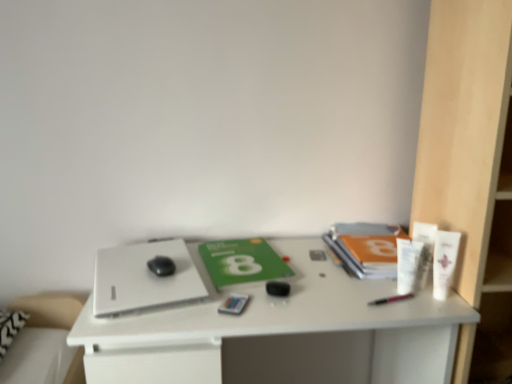
You are a GUI agent. You are given a task and a screenshot of the screen. Output one action in this format:
    pyautogui.click(x=<x>, y=<y>)
    Task: Click on the vacant area that lies between green matte paperback book at center, the second paperback book in the right-to-left sequence, and white plastic tube at right, the first toiletry from the left
    The height and width of the screenshot is (384, 512).
    Given the screenshot: What is the action you would take?
    pyautogui.click(x=327, y=279)